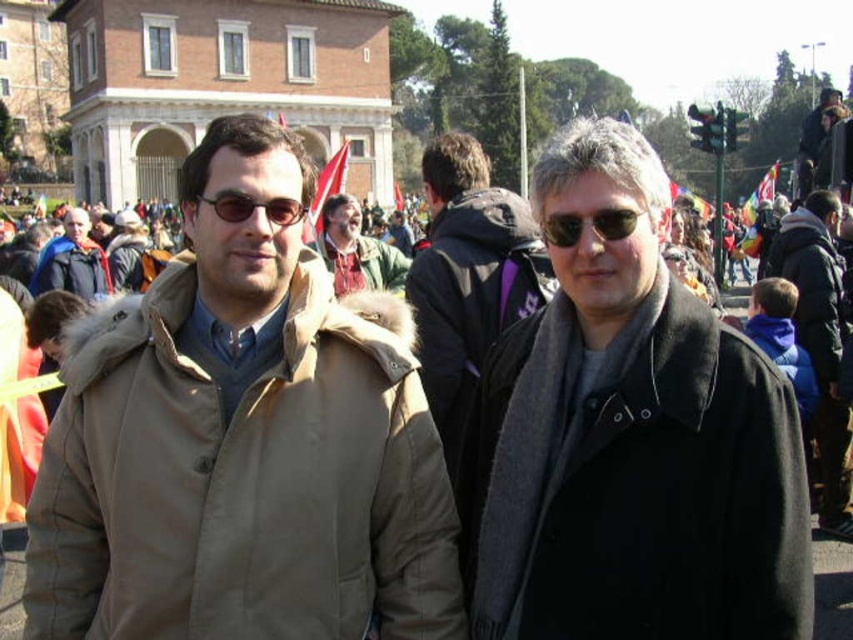
Image resolution: width=853 pixels, height=640 pixels. I want to click on dark gray wool scarf at center, so click(631, 442).

At what (x,y) coordinates should I click in order to perform the action: click on dark gray wool scarf at center. Please return your answer as a coordinate pair (x, y). Looking at the image, I should click on (631, 442).

Is matte black jacket at left thinner than matte black sunglasses at center?

No, matte black jacket at left is not thinner than matte black sunglasses at center.

Does matte black jacket at left have a greater width compared to matte black sunglasses at center?

Indeed, matte black jacket at left has a greater width compared to matte black sunglasses at center.

Is point (39, 260) behind point (234, 198)?

Yes, point (39, 260) is behind point (234, 198).

Where is `matte black jacket at left`? The height and width of the screenshot is (640, 853). matte black jacket at left is located at coordinates (73, 260).

Who is more distant from viewer, (230,401) or (248,200)?

Point (248,200)

Does tan fabric coat at left appear on the right side of matte black sunglasses at center?

Yes, tan fabric coat at left is to the right of matte black sunglasses at center.

Between point (308, 168) and point (229, 196), which one is positioned in front?

Point (229, 196) is more forward.

The height and width of the screenshot is (640, 853). In order to click on tan fabric coat at left in this screenshot , I will do `click(241, 444)`.